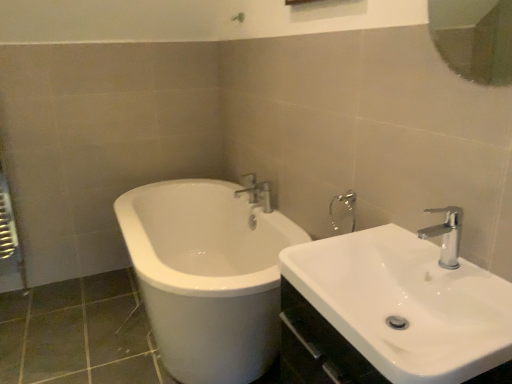
Question: Is white glossy sink at lower right with glossy glass mirror at upper right?

Choices:
 (A) no
 (B) yes

Answer: (A)

Question: From a real-world perspective, is white glossy sink at lower right located higher than glossy glass mirror at upper right?

Choices:
 (A) no
 (B) yes

Answer: (A)

Question: Is white glossy sink at lower right further to the viewer compared to glossy glass mirror at upper right?

Choices:
 (A) yes
 (B) no

Answer: (A)

Question: From a real-world perspective, is white glossy sink at lower right under glossy glass mirror at upper right?

Choices:
 (A) no
 (B) yes

Answer: (B)

Question: Is the depth of white glossy sink at lower right less than that of glossy glass mirror at upper right?

Choices:
 (A) yes
 (B) no

Answer: (B)

Question: Visually, is white glossy sink at lower right positioned to the left or to the right of chrome metallic faucet at upper right, which ranks as the 1th tap in right-to-left order?

Choices:
 (A) left
 (B) right

Answer: (A)

Question: From the image's perspective, is white glossy sink at lower right above or below chrome metallic faucet at upper right, which ranks as the 1th tap in right-to-left order?

Choices:
 (A) below
 (B) above

Answer: (A)

Question: Is white glossy sink at lower right inside or outside of chrome metallic faucet at upper right, the second tap when ordered from left to right?

Choices:
 (A) inside
 (B) outside

Answer: (B)

Question: Considering the positions of point (478, 345) and point (436, 210), is point (478, 345) closer or farther from the camera than point (436, 210)?

Choices:
 (A) closer
 (B) farther

Answer: (A)

Question: Is glossy glass mirror at upper right wider or thinner than chrome metallic faucet at upper right, which is counted as the 1th tap, starting from the front?

Choices:
 (A) thin
 (B) wide

Answer: (A)

Question: In the image, is glossy glass mirror at upper right on the left side or the right side of chrome metallic faucet at upper right, the second tap positioned from the back?

Choices:
 (A) left
 (B) right

Answer: (B)

Question: Is point (501, 84) closer or farther from the camera than point (438, 259)?

Choices:
 (A) closer
 (B) farther

Answer: (B)

Question: Is glossy glass mirror at upper right inside the boundaries of chrome metallic faucet at upper right, the second tap when ordered from left to right, or outside?

Choices:
 (A) inside
 (B) outside

Answer: (B)

Question: Considering their positions, is glossy glass mirror at upper right located in front of or behind chrome metallic faucet at upper center, acting as the 2th tap starting from the front?

Choices:
 (A) behind
 (B) front

Answer: (B)

Question: Choose the correct answer: Is glossy glass mirror at upper right inside chrome metallic faucet at upper center, acting as the 2th tap starting from the front, or outside it?

Choices:
 (A) inside
 (B) outside

Answer: (B)